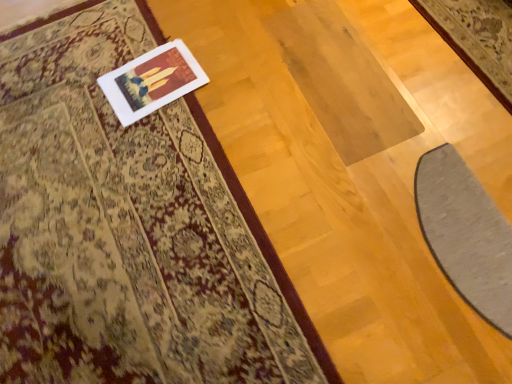
Question: From the image's perspective, is white matte picture frame at upper left below gray soft mat at lower right?

Choices:
 (A) no
 (B) yes

Answer: (A)

Question: Is white matte picture frame at upper left far from gray soft mat at lower right?

Choices:
 (A) yes
 (B) no

Answer: (B)

Question: Considering the relative positions of white matte picture frame at upper left and gray soft mat at lower right in the image provided, is white matte picture frame at upper left to the right of gray soft mat at lower right from the viewer's perspective?

Choices:
 (A) yes
 (B) no

Answer: (B)

Question: Is white matte picture frame at upper left aimed at gray soft mat at lower right?

Choices:
 (A) yes
 (B) no

Answer: (B)

Question: Does white matte picture frame at upper left have a smaller size compared to gray soft mat at lower right?

Choices:
 (A) no
 (B) yes

Answer: (B)

Question: Considering the positions of silky beige rug at upper left and gray soft mat at lower right in the image, is silky beige rug at upper left wider or thinner than gray soft mat at lower right?

Choices:
 (A) thin
 (B) wide

Answer: (B)

Question: Is silky beige rug at upper left in front of or behind gray soft mat at lower right in the image?

Choices:
 (A) front
 (B) behind

Answer: (A)

Question: Is point (42, 59) positioned closer to the camera than point (445, 246)?

Choices:
 (A) farther
 (B) closer

Answer: (A)

Question: In terms of size, does silky beige rug at upper left appear bigger or smaller than gray soft mat at lower right?

Choices:
 (A) big
 (B) small

Answer: (A)

Question: In terms of height, does silky beige rug at upper left look taller or shorter compared to white matte picture frame at upper left?

Choices:
 (A) short
 (B) tall

Answer: (B)

Question: Is silky beige rug at upper left to the left or to the right of white matte picture frame at upper left in the image?

Choices:
 (A) left
 (B) right

Answer: (A)

Question: Is silky beige rug at upper left situated inside white matte picture frame at upper left or outside?

Choices:
 (A) inside
 (B) outside

Answer: (B)

Question: Is point (49, 44) closer or farther from the camera than point (196, 64)?

Choices:
 (A) farther
 (B) closer

Answer: (A)

Question: Considering the relative positions of gray soft mat at lower right and silky beige rug at upper left in the image provided, is gray soft mat at lower right to the left or to the right of silky beige rug at upper left?

Choices:
 (A) left
 (B) right

Answer: (B)

Question: From the image's perspective, is gray soft mat at lower right positioned above or below silky beige rug at upper left?

Choices:
 (A) above
 (B) below

Answer: (B)